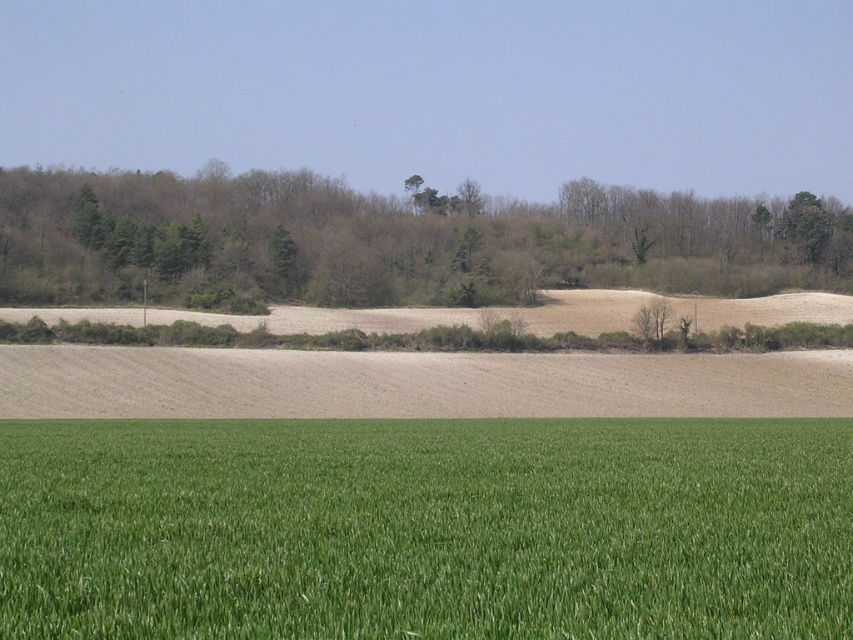
You are standing in the middle of the green grass at lower center and want to walk towards the green leafy trees at upper center. Which direction should you head to reach them?

The green grass at lower center is positioned on the right side of green leafy trees at upper center, so you should head to the left to reach them.